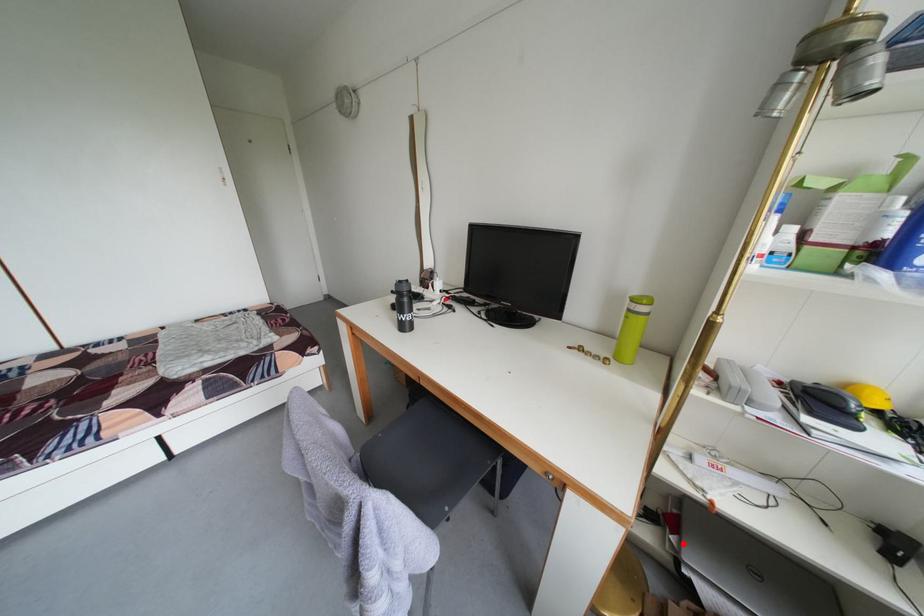
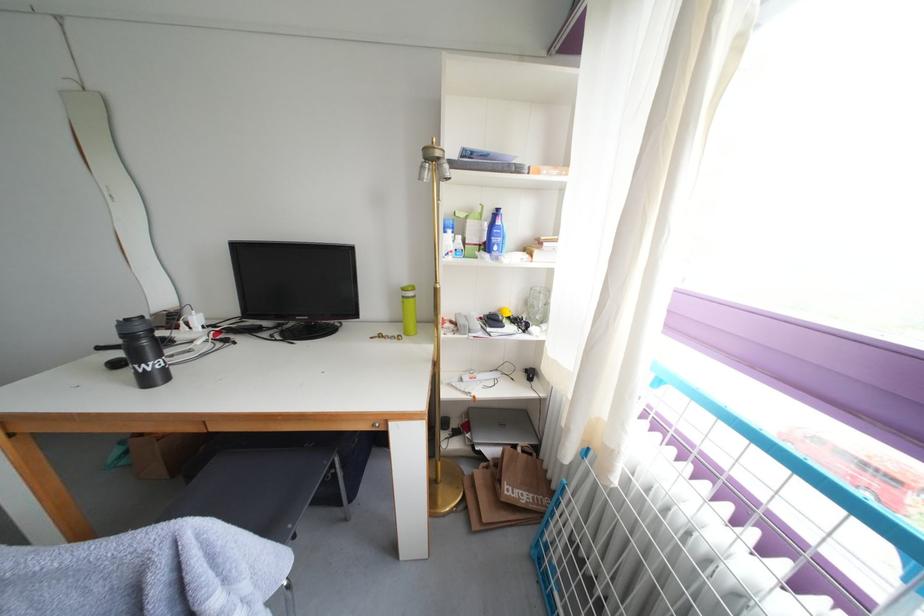
Locate, in the second image, the point that corresponds to the highlighted location in the first image.

(478, 440)